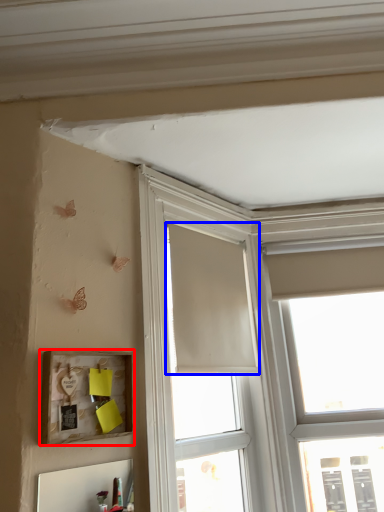
Question: Which point is further to the camera, picture frame (highlighted by a red box) or curtain (highlighted by a blue box)?

Choices:
 (A) picture frame
 (B) curtain

Answer: (B)